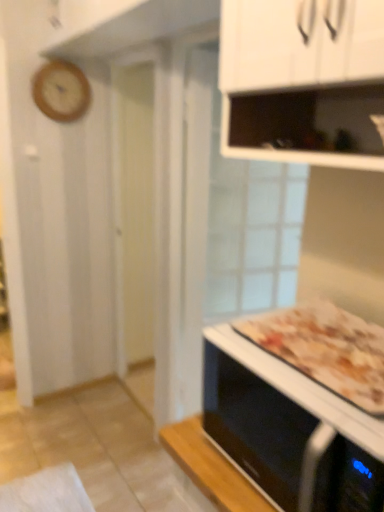
Question: From the image's perspective, would you say golden brown crusty pizza at lower right is shown under black glossy microwave oven at lower right?

Choices:
 (A) yes
 (B) no

Answer: (B)

Question: Is golden brown crusty pizza at lower right positioned beyond the bounds of black glossy microwave oven at lower right?

Choices:
 (A) yes
 (B) no

Answer: (A)

Question: Is black glossy microwave oven at lower right at the back of golden brown crusty pizza at lower right?

Choices:
 (A) no
 (B) yes

Answer: (A)

Question: From a real-world perspective, is golden brown crusty pizza at lower right located higher than black glossy microwave oven at lower right?

Choices:
 (A) no
 (B) yes

Answer: (B)

Question: Is the position of golden brown crusty pizza at lower right less distant than that of black glossy microwave oven at lower right?

Choices:
 (A) yes
 (B) no

Answer: (B)

Question: Is wooden clock at upper left situated inside black glossy microwave oven at lower right or outside?

Choices:
 (A) outside
 (B) inside

Answer: (A)

Question: Looking at their shapes, would you say wooden clock at upper left is wider or thinner than black glossy microwave oven at lower right?

Choices:
 (A) wide
 (B) thin

Answer: (B)

Question: Is wooden clock at upper left to the left or to the right of black glossy microwave oven at lower right in the image?

Choices:
 (A) right
 (B) left

Answer: (B)

Question: Considering the positions of wooden clock at upper left and black glossy microwave oven at lower right in the image, is wooden clock at upper left bigger or smaller than black glossy microwave oven at lower right?

Choices:
 (A) small
 (B) big

Answer: (A)

Question: From a real-world perspective, is golden brown crusty pizza at lower right physically located above or below black glossy microwave oven at lower right?

Choices:
 (A) below
 (B) above

Answer: (B)

Question: From the image's perspective, is golden brown crusty pizza at lower right above or below black glossy microwave oven at lower right?

Choices:
 (A) below
 (B) above

Answer: (B)

Question: Visually, is golden brown crusty pizza at lower right positioned to the left or to the right of black glossy microwave oven at lower right?

Choices:
 (A) right
 (B) left

Answer: (A)

Question: In the image, is golden brown crusty pizza at lower right positioned in front of or behind black glossy microwave oven at lower right?

Choices:
 (A) front
 (B) behind

Answer: (B)

Question: From a real-world perspective, is wooden clock at upper left above or below golden brown crusty pizza at lower right?

Choices:
 (A) below
 (B) above

Answer: (B)

Question: Which is correct: wooden clock at upper left is inside golden brown crusty pizza at lower right, or outside of it?

Choices:
 (A) outside
 (B) inside

Answer: (A)